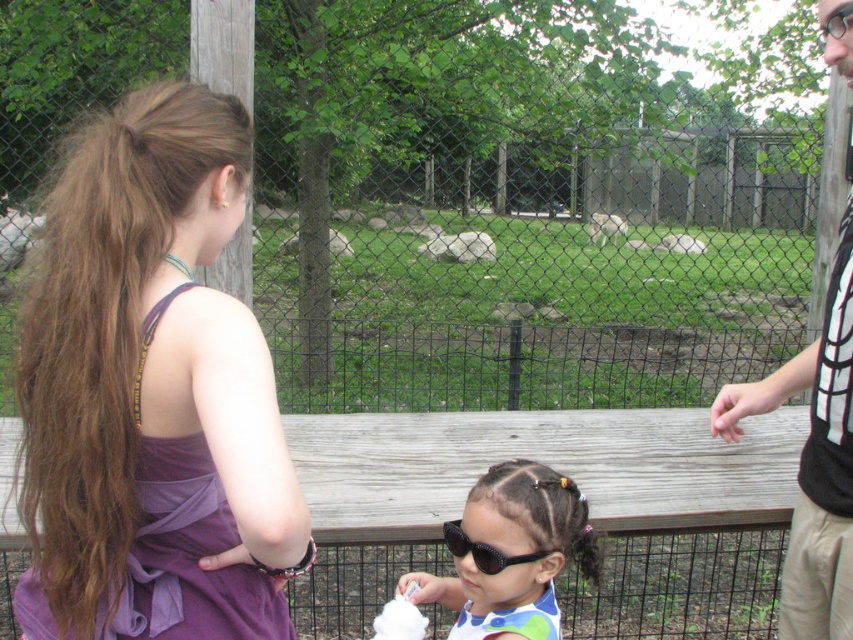
You are standing on the wooden platform at the zoo and see the gray stone rock at center and the white fur animal at center. Which object is located directly above the other?

The white fur animal at center is directly above the gray stone rock at center because the gray stone rock at center is positioned under it.

You are a visitor at the zoo and want to know if the metal mesh fence at center is wider than the purple fabric dress at left. Can you confirm this?

The metal mesh fence at center is wider than the purple fabric dress at left according to the description.